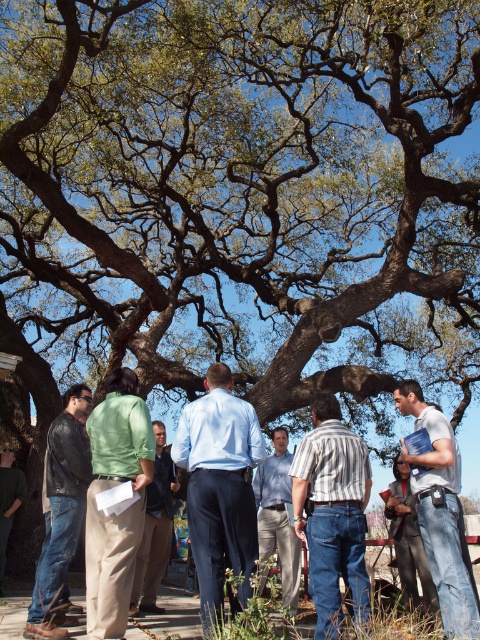
Question: Is blue cotton shirt at center below green matte shirt at center?

Choices:
 (A) no
 (B) yes

Answer: (A)

Question: Which point is closer to the camera?

Choices:
 (A) green shirt at center
 (B) striped cotton shirt at center
 (C) blue shirt at center

Answer: (B)

Question: Among these points, which one is nearest to the camera?

Choices:
 (A) (156, 426)
 (B) (291, 536)
 (C) (61, 588)

Answer: (C)

Question: Can you confirm if blue shirt at center is bigger than green shirt at center?

Choices:
 (A) no
 (B) yes

Answer: (B)

Question: Is striped cotton shirt at center thinner than matte black jacket at left?

Choices:
 (A) no
 (B) yes

Answer: (B)

Question: Among these objects, which one is nearest to the camera?

Choices:
 (A) striped cotton shirt at center
 (B) matte black jacket at left

Answer: (A)